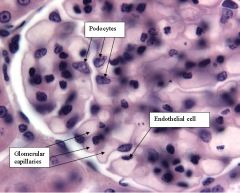
Find the location of a particular element. The height and width of the screenshot is (193, 240). box is located at coordinates (205, 120), (111, 27), (29, 161).